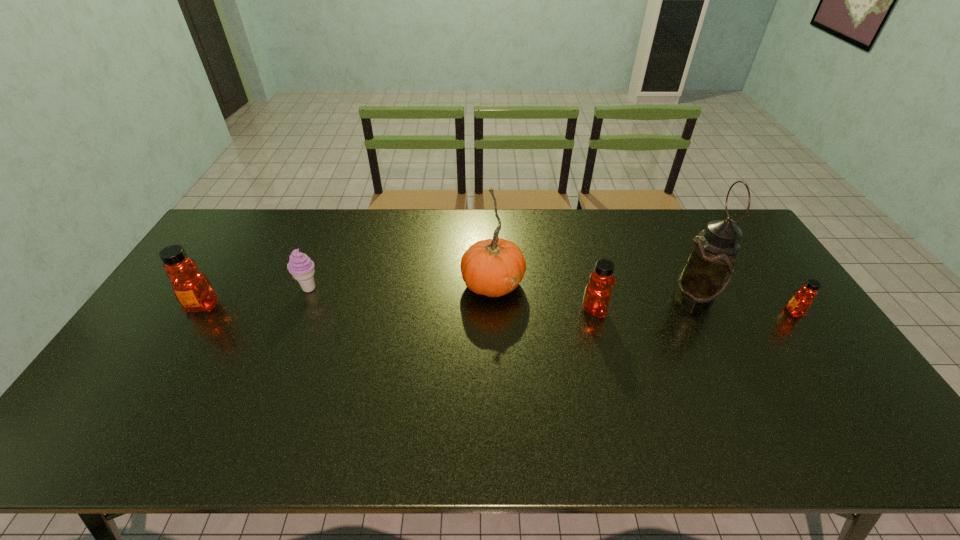
This screenshot has width=960, height=540. Find the location of `empty space that is in between the oil lamp and the rightmost honey`. empty space that is in between the oil lamp and the rightmost honey is located at coordinates (745, 304).

Image resolution: width=960 pixels, height=540 pixels. I want to click on vacant area between the rightmost object and the second object from right to left, so click(745, 304).

I want to click on free spot between the second object from left to right and the leftmost object, so click(256, 298).

Locate which object ranks fifth in proximity to the second tallest honey. Please provide its 2D coordinates. Your answer should be formatted as a tuple, i.e. [(x, y)], where the tuple contains the x and y coordinates of a point satisfying the conditions above.

[(192, 288)]

You are a GUI agent. You are given a task and a screenshot of the screen. Output one action in this format:
    pyautogui.click(x=<x>, y=<y>)
    Task: Click on the object identified as the third closest to the leftmost object
    The height and width of the screenshot is (540, 960).
    Given the screenshot: What is the action you would take?
    pyautogui.click(x=597, y=295)

Identify the location of the third closest honey to the oil lamp. (192, 288).

You are a GUI agent. You are given a task and a screenshot of the screen. Output one action in this format:
    pyautogui.click(x=<x>, y=<y>)
    Task: Click on the honey that is the second closest to the second tallest object
    
    Given the screenshot: What is the action you would take?
    pyautogui.click(x=192, y=288)